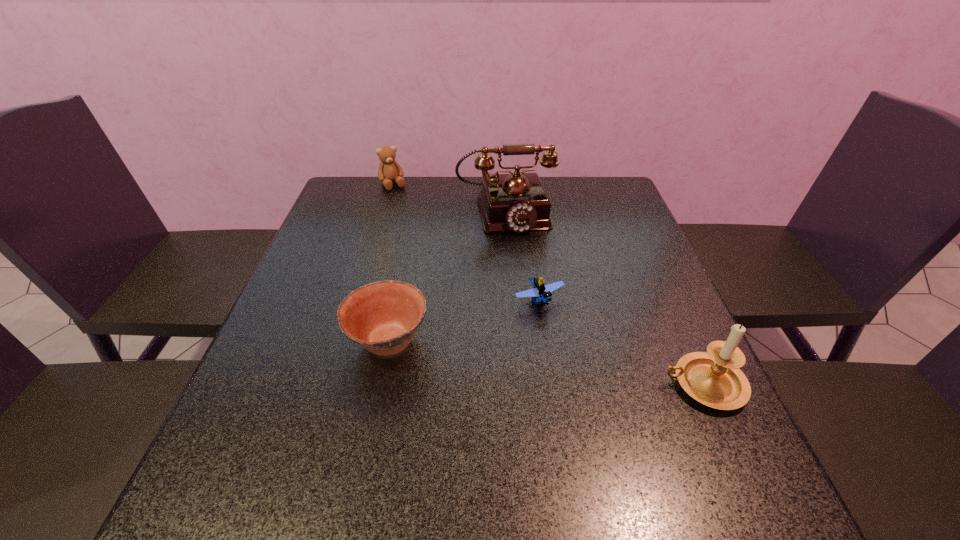
Find the location of a particular element. The width and height of the screenshot is (960, 540). bowl is located at coordinates (382, 317).

Identify the location of candle holder. (713, 378).

You are a GUI agent. You are given a task and a screenshot of the screen. Output one action in this format:
    pyautogui.click(x=<x>, y=<y>)
    Task: Click on the rightmost object
    This screenshot has height=540, width=960.
    Given the screenshot: What is the action you would take?
    pyautogui.click(x=713, y=378)

Image resolution: width=960 pixels, height=540 pixels. What are the coordinates of `telephone` in the screenshot? It's located at (517, 202).

Where is `the third shortest object`? the third shortest object is located at coordinates (389, 170).

Where is `the shortest object`? the shortest object is located at coordinates [542, 292].

This screenshot has height=540, width=960. I want to click on free space located 0.280m on the back of the bowl, so click(x=409, y=237).

In order to click on vacant space located 0.370m with a handle on the side of the rightmost object in this screenshot , I will do `click(468, 384)`.

Find the location of a particular element. The width and height of the screenshot is (960, 540). vacant area situated 0.080m with a handle on the side of the rightmost object is located at coordinates tap(620, 384).

Identify the location of free spot located 0.130m with a handle on the side of the rightmost object. The width and height of the screenshot is (960, 540). (593, 384).